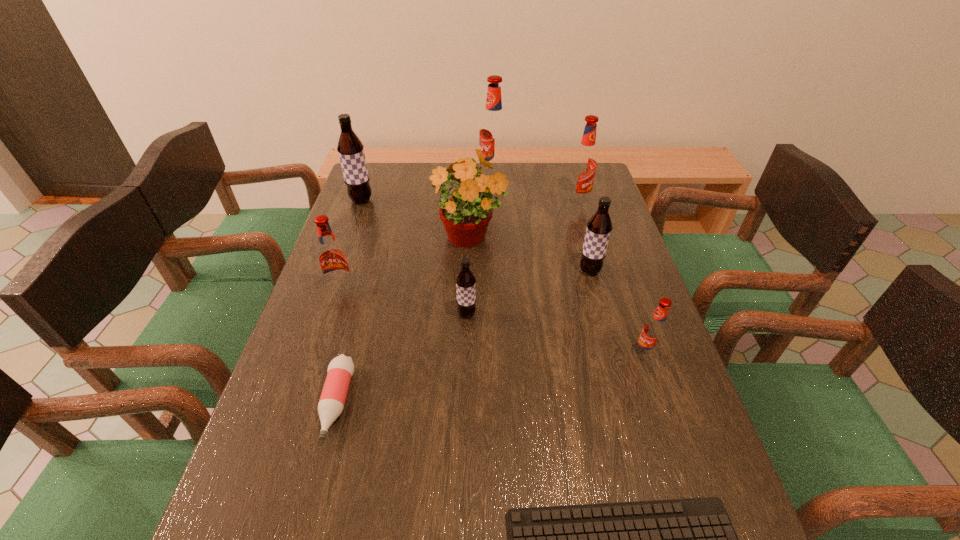
Identify the location of vacant area situated 0.200m on the back of the second farthest brown root beer. This screenshot has height=540, width=960. (577, 222).

Identify the location of vacant region located 0.290m on the right of the fifth farthest root beer. This screenshot has width=960, height=540. (461, 291).

Identify the location of vacant space located 0.070m on the back of the second brown root beer from left to right. (468, 288).

I want to click on vacant space located 0.100m on the front of the nearest red root beer, so click(660, 401).

Where is `blank area located with the cap open on the third object from left to right`? Image resolution: width=960 pixels, height=540 pixels. blank area located with the cap open on the third object from left to right is located at coordinates (311, 498).

At what (x,y) coordinates should I click in order to perform the action: click on bottle that is at the left edge. Please return your answer as a coordinate pair (x, y). Looking at the image, I should click on (340, 370).

Find the location of a particular element. This screenshot has height=540, width=960. object located at the far left corner is located at coordinates (351, 153).

Locate an element on the screen. The height and width of the screenshot is (540, 960). object located in the far right corner section of the desktop is located at coordinates (583, 167).

The width and height of the screenshot is (960, 540). I want to click on blank space at the far edge, so click(542, 183).

Locate an element on the screen. free region at the left edge of the desktop is located at coordinates (304, 442).